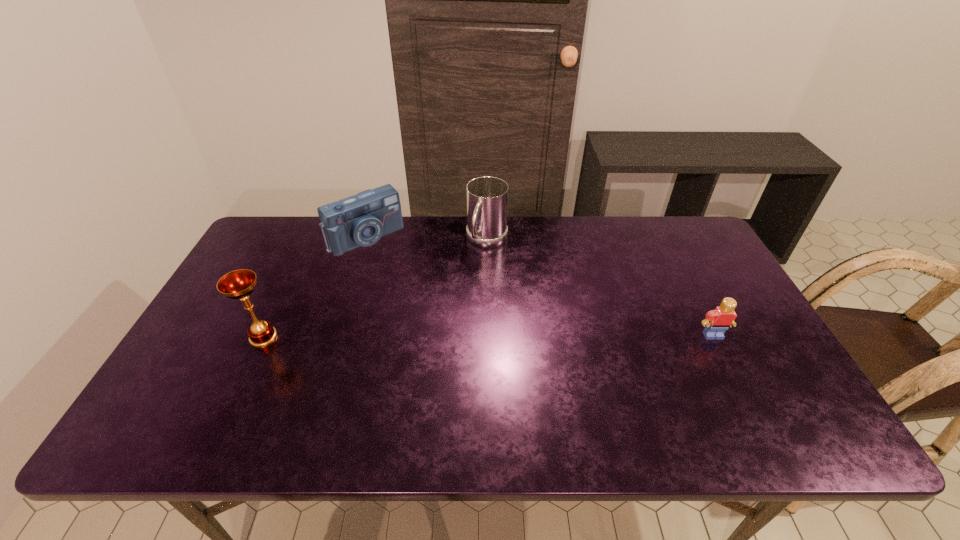
I want to click on free space between the Lego and the second object from left to right, so click(x=540, y=286).

You are a GUI agent. You are given a task and a screenshot of the screen. Output one action in this format:
    pyautogui.click(x=<x>, y=<y>)
    Task: Click on the vacant area that lies between the camera and the rightmost object
    This screenshot has width=960, height=540.
    Given the screenshot: What is the action you would take?
    pyautogui.click(x=540, y=286)

Identify the location of object that can be found as the closest to the rightmost object. (487, 197).

The image size is (960, 540). In order to click on object that is the closest to the third object from left to right in this screenshot , I will do `click(360, 220)`.